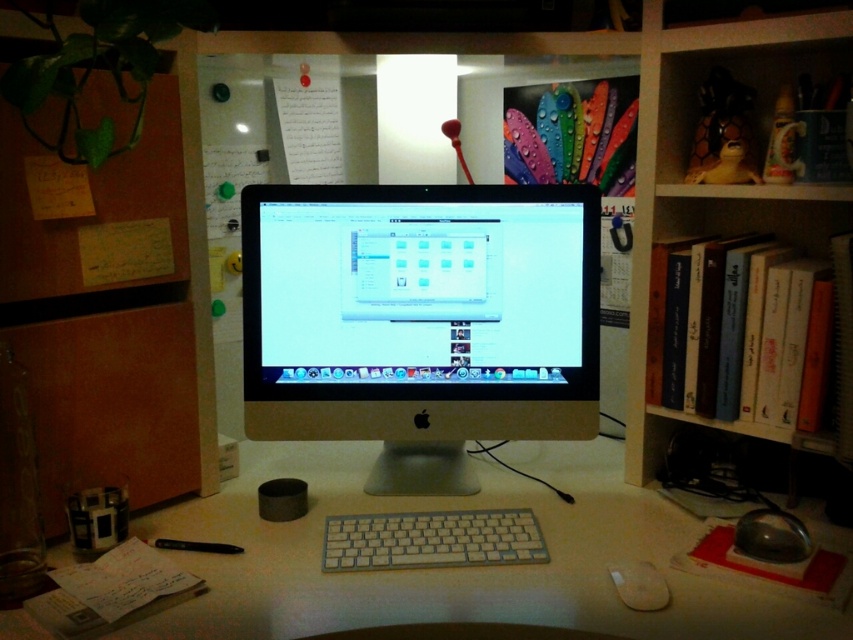
Question: Considering the relative positions of white plastic computer desk at center and white plastic keyboard at center in the image provided, where is white plastic computer desk at center located with respect to white plastic keyboard at center?

Choices:
 (A) right
 (B) left

Answer: (A)

Question: Among these points, which one is farthest from the camera?

Choices:
 (A) (833, 529)
 (B) (517, 397)

Answer: (B)

Question: Among these objects, which one is farthest from the camera?

Choices:
 (A) white matte mouse at lower right
 (B) white plastic computer desk at center

Answer: (A)

Question: Which of the following is the closest to the observer?

Choices:
 (A) satin gold monitor at center
 (B) burlap paper at left
 (C) white plastic computer desk at center

Answer: (C)

Question: Can you confirm if burlap paper at left is positioned below white matte mouse at lower right?

Choices:
 (A) no
 (B) yes

Answer: (A)

Question: Can you confirm if burlap paper at left is bigger than white plastic keyboard at center?

Choices:
 (A) yes
 (B) no

Answer: (A)